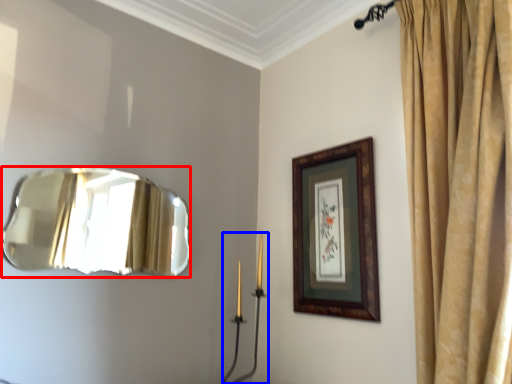
Question: Which object appears closest to the camera in this image, mirror (highlighted by a red box) or candle holder (highlighted by a blue box)?

Choices:
 (A) mirror
 (B) candle holder

Answer: (A)